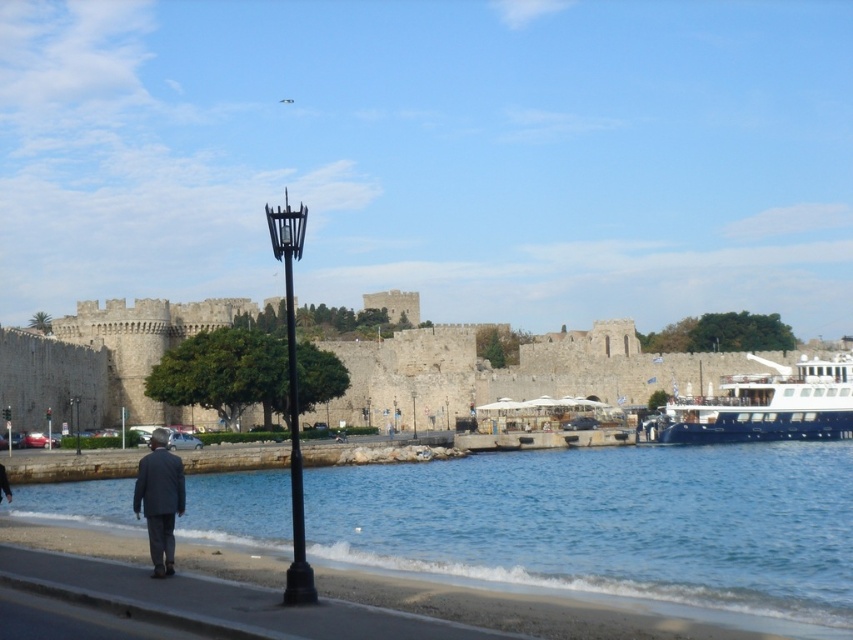
You are a tourist standing on the beach and want to take a photo of the dark gray suit at lower left and the black metal streetlight at center. Which object should you focus on first if you want to capture both in one frame without moving your camera?

You should focus on the black metal streetlight at center first because it is taller than the dark gray suit at lower left, allowing it to be captured in the frame more easily.

In the scene shown: You are standing at the origin point in the scene. Which direction should you move to reach the blue water at lower center?

The blue water at lower center is located at coordinates approximately 0.822 on the x axis and 0.720 on the y axis. Since you are at the origin point, you should move towards the positive x and positive y direction to reach it.

Consider the image. You are a photographer standing on the sandy beach in the coastal scene. You want to capture a photo that includes both the blue water at lower center and the black metal lamp post at lower center. Based on their sizes in the image, which object should you frame first to ensure both are visible in the shot?

The blue water at lower center has a larger width than the black metal lamp post at lower center, so you should frame the blue water at lower center first to ensure both objects are visible in the photo.